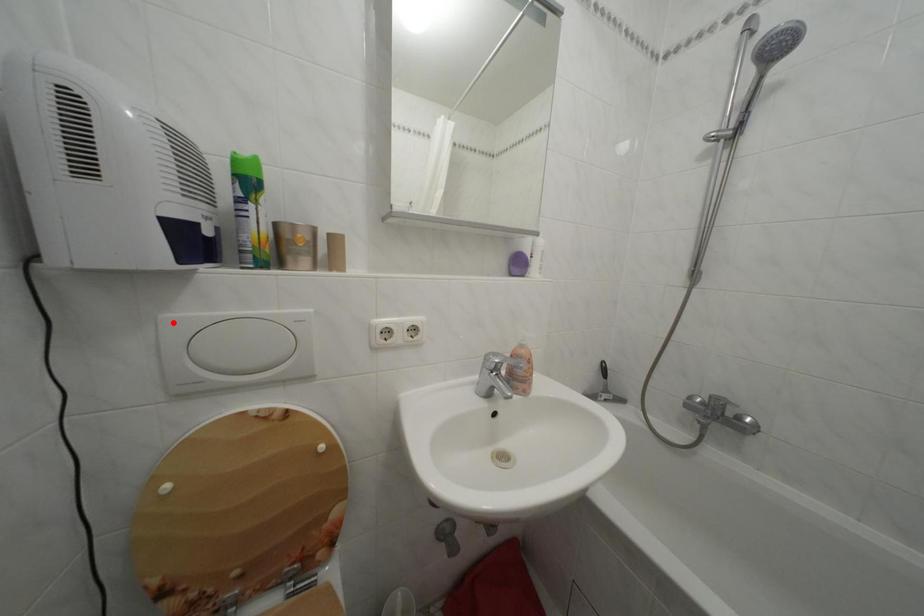
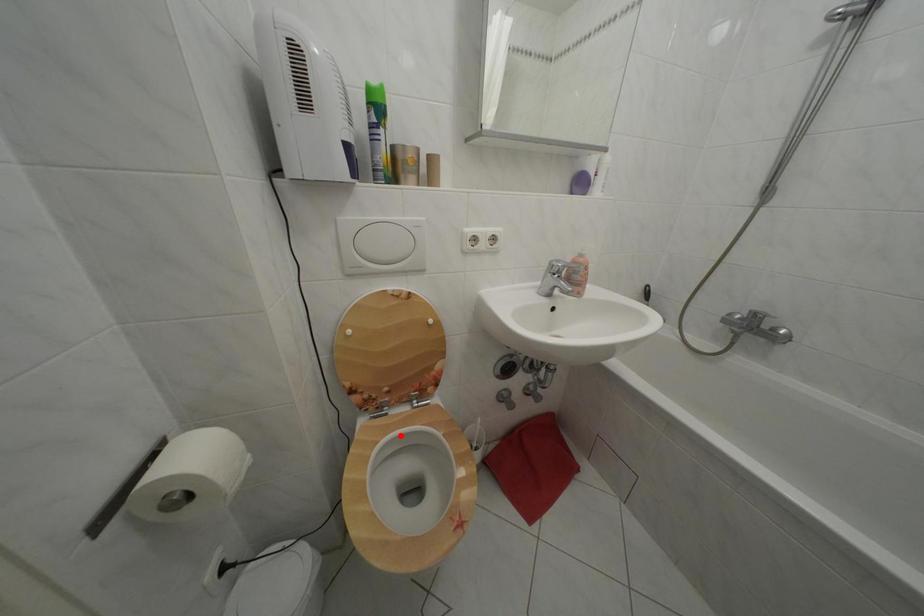
I am providing you with two images of the same scene from different viewpoints. A red point is marked on the first image and another point is marked on the second image. Is the red point in image1 aligned with the point shown in image2?

No